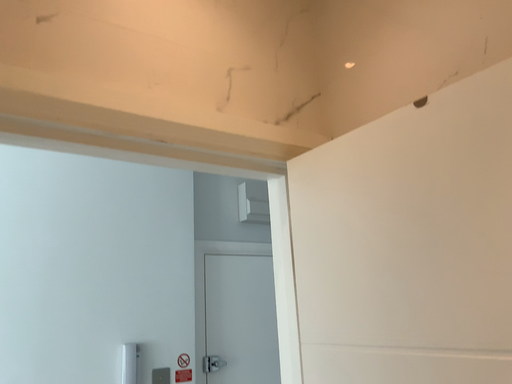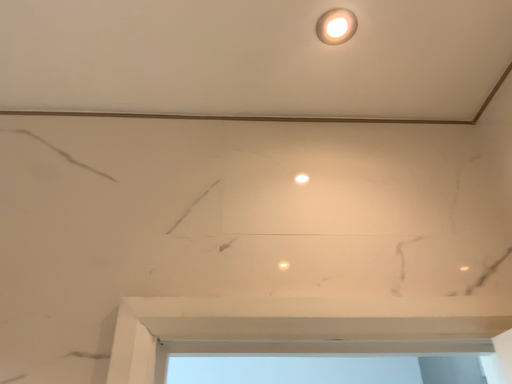
Question: Which way did the camera rotate in the video?

Choices:
 (A) rotated upward
 (B) rotated downward

Answer: (A)